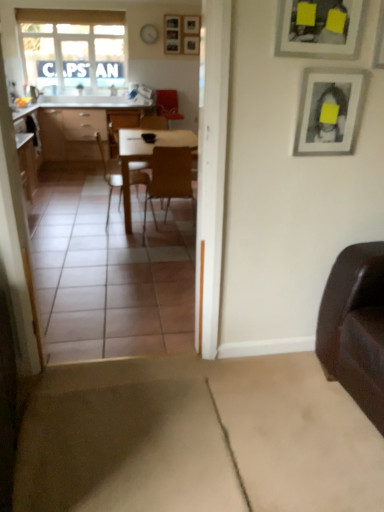
Question: From the image's perspective, would you say matte wood desk at center is shown under wooden at center, which appears as the first chair when viewed from the right?

Choices:
 (A) no
 (B) yes

Answer: (A)

Question: Can wooden at center, which appears as the first chair when viewed from the right, be found inside matte wood desk at center?

Choices:
 (A) yes
 (B) no

Answer: (B)

Question: Is matte wood desk at center taller than wooden at center, which is the second chair in left-to-right order?

Choices:
 (A) yes
 (B) no

Answer: (A)

Question: Is matte wood desk at center positioned beyond the bounds of wooden at center, which is the second chair in left-to-right order?

Choices:
 (A) no
 (B) yes

Answer: (B)

Question: Is matte wood desk at center thinner than wooden at center, which appears as the first chair when viewed from the right?

Choices:
 (A) yes
 (B) no

Answer: (B)

Question: Is point (158, 92) positioned closer to the camera than point (329, 36)?

Choices:
 (A) farther
 (B) closer

Answer: (A)

Question: In the image, is velvet red armchair at center positioned in front of or behind matte black picture frame at upper right, acting as the second picture frame starting from the right?

Choices:
 (A) front
 (B) behind

Answer: (B)

Question: Do you think velvet red armchair at center is within matte black picture frame at upper right, which is counted as the second picture frame, starting from the bottom, or outside of it?

Choices:
 (A) outside
 (B) inside

Answer: (A)

Question: In terms of height, does velvet red armchair at center look taller or shorter compared to matte black picture frame at upper right, which is counted as the second picture frame, starting from the bottom?

Choices:
 (A) tall
 (B) short

Answer: (A)

Question: Looking at the image, does wooden picture frame at upper center, the first picture frame positioned from the left, seem bigger or smaller compared to wooden at center, which is the second chair in left-to-right order?

Choices:
 (A) small
 (B) big

Answer: (A)

Question: Considering the positions of wooden picture frame at upper center, positioned as the 1th picture frame in back-to-front order, and wooden at center, which appears as the first chair when viewed from the right, in the image, is wooden picture frame at upper center, positioned as the 1th picture frame in back-to-front order, wider or thinner than wooden at center, which appears as the first chair when viewed from the right,?

Choices:
 (A) thin
 (B) wide

Answer: (A)

Question: Would you say wooden picture frame at upper center, the first picture frame positioned from the left, is inside or outside wooden at center, which appears as the first chair when viewed from the right?

Choices:
 (A) outside
 (B) inside

Answer: (A)

Question: Based on their positions, is wooden picture frame at upper center, the first picture frame positioned from the left, located to the left or right of wooden at center, which appears as the first chair when viewed from the right?

Choices:
 (A) right
 (B) left

Answer: (B)

Question: Based on their sizes in the image, would you say matte black picture frame at upper right, the 1th picture frame in the front-to-back sequence, is bigger or smaller than wooden at center, which is the second chair in left-to-right order?

Choices:
 (A) big
 (B) small

Answer: (B)

Question: Is matte black picture frame at upper right, which is the second picture frame in left-to-right order, in front of or behind wooden at center, which is the second chair in left-to-right order, in the image?

Choices:
 (A) behind
 (B) front

Answer: (B)